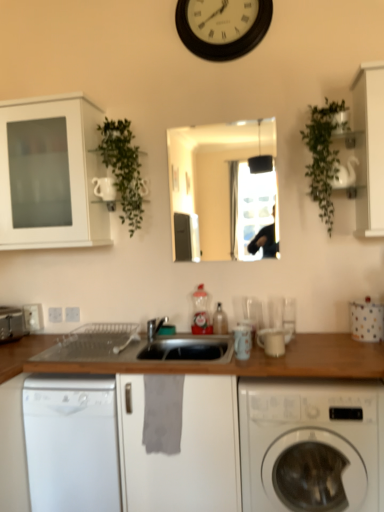
This screenshot has width=384, height=512. Find the location of `free space in front of white ceramic mug at center, the third appliance when ordered from left to right`. free space in front of white ceramic mug at center, the third appliance when ordered from left to right is located at coordinates (280, 362).